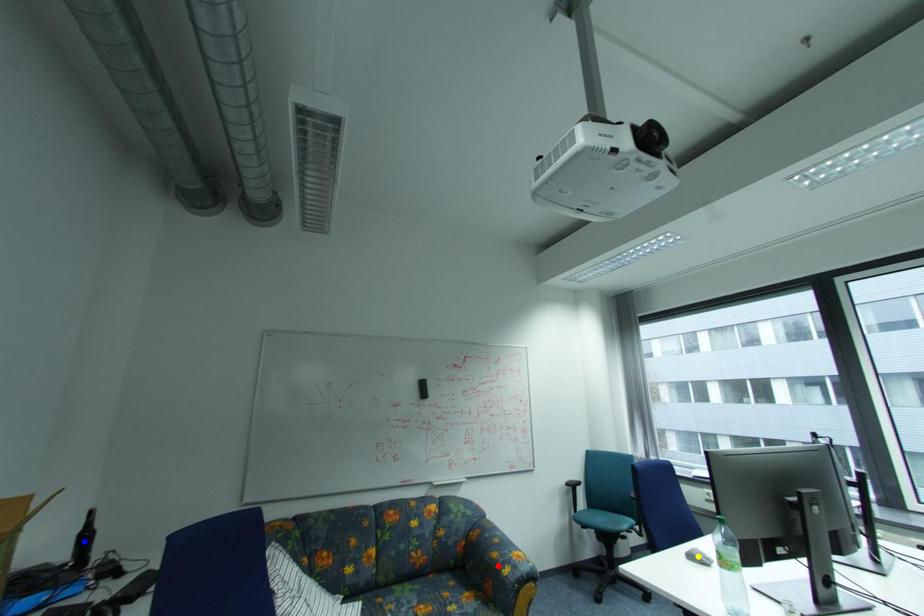
Order these from farthest to nearest:
- red point
- yellow point
- blue point

red point, yellow point, blue point